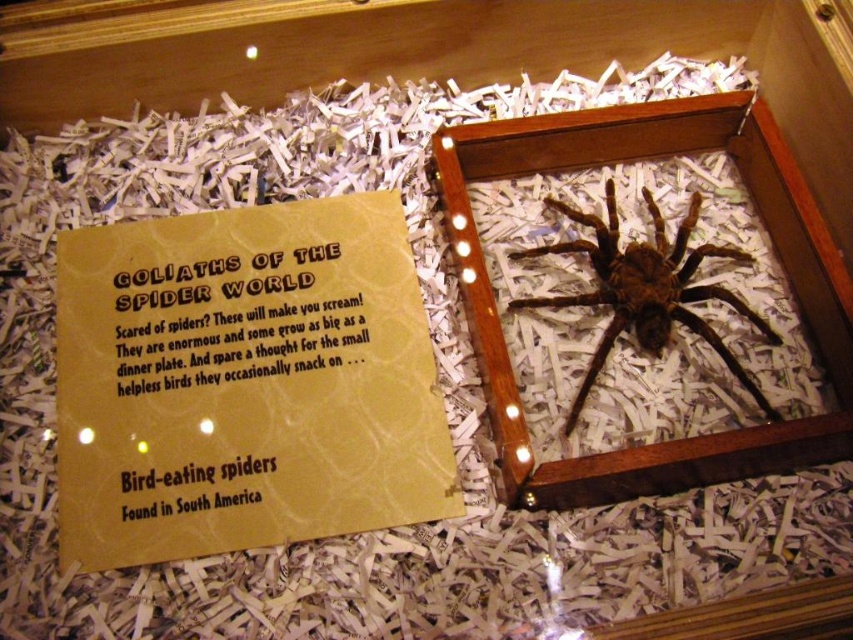
You are standing in front of the display case and want to touch the closest point to you. Which point should you choose between point (270, 276) and point (645, 266)?

Point (270, 276) is closer to the viewer than point (645, 266), so you should choose point (270, 276).

You are a visitor at a museum exhibit and see the yellow paper at center and the brown fuzzy spider at center. According to the display, which one is positioned to the left?

The yellow paper at center is positioned to the left of the brown fuzzy spider at center.

You are a museum visitor holding a small flashlight. You want to shine the light on both the brown paper sign at upper left and the brown fuzzy spider at center. If your flashlight can only reach 40 centimeters, will you be able to light both objects without moving your position?

The brown paper sign at upper left and brown fuzzy spider at center are 44.07 centimeters apart. Since the distance between them exceeds the flashlight range of 40 centimeters, you cannot illuminate both objects simultaneously without moving.